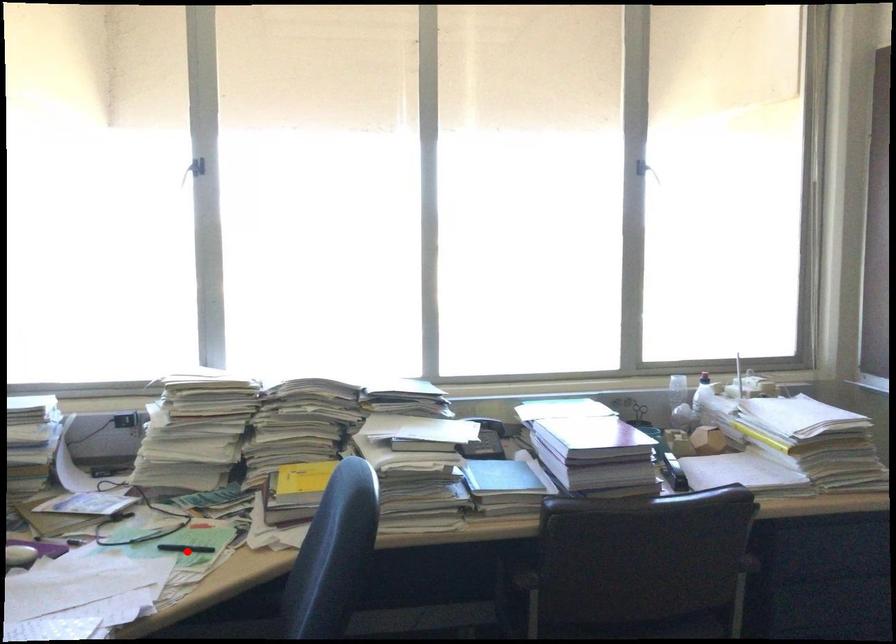
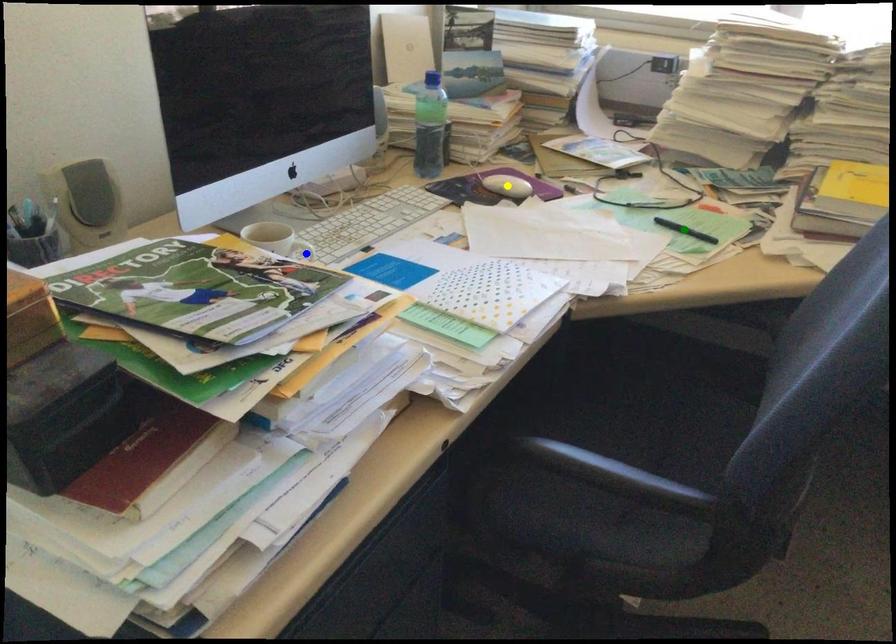
Question: I am providing you with two images of the same scene from different viewpoints. A red point is marked on the first image. You are given multiple points on the second image. Which point in image 2 represents the same 3d spot as the red point in image 1?

Choices:
 (A) blue point
 (B) green point
 (C) yellow point

Answer: (B)